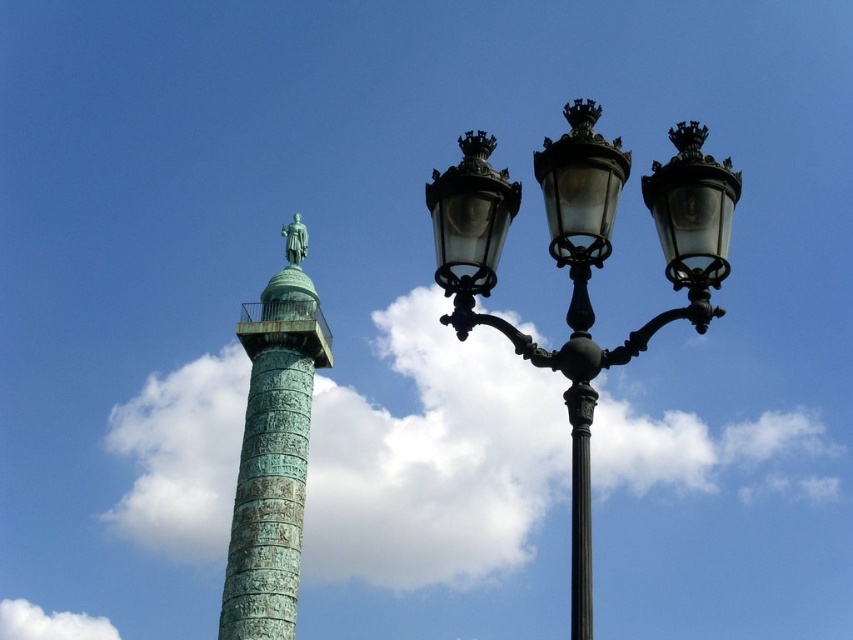
Who is shorter, white fluffy cloud at upper center or green patinated bronze statue at upper center?

green patinated bronze statue at upper center

Find the location of a particular element. This screenshot has width=853, height=640. white fluffy cloud at upper center is located at coordinates (433, 460).

You are a GUI agent. You are given a task and a screenshot of the screen. Output one action in this format:
    pyautogui.click(x=<x>, y=<y>)
    Task: Click on the white fluffy cloud at upper center
    Image resolution: width=853 pixels, height=640 pixels.
    Given the screenshot: What is the action you would take?
    [x=433, y=460]

Is green patina column at upper left closer to the viewer compared to white fluffy cloud at lower left?

That is True.

Does green patina column at upper left have a smaller size compared to white fluffy cloud at lower left?

No.

Measure the distance between green patina column at upper left and camera.

green patina column at upper left and camera are 104.72 meters apart.

The width and height of the screenshot is (853, 640). Find the location of `green patina column at upper left`. green patina column at upper left is located at coordinates (273, 458).

Does green patina column at upper left have a lesser height compared to green patina glass streetlight at center?

In fact, green patina column at upper left may be taller than green patina glass streetlight at center.

Can you confirm if green patina column at upper left is positioned above green patina glass streetlight at center?

Incorrect, green patina column at upper left is not positioned above green patina glass streetlight at center.

Which is behind, point (236, 572) or point (461, 168)?

Point (236, 572)

I want to click on green patina column at upper left, so click(x=273, y=458).